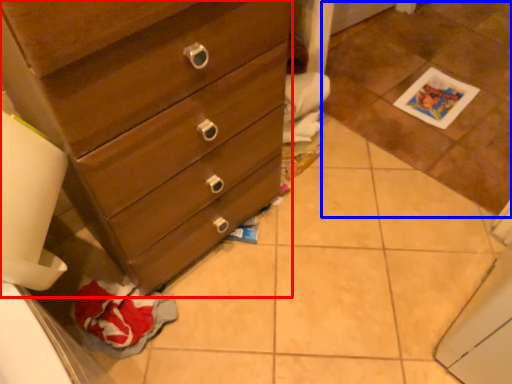
Question: Among these objects, which one is farthest to the camera, chest of drawers (highlighted by a red box) or tile (highlighted by a blue box)?

Choices:
 (A) chest of drawers
 (B) tile

Answer: (B)